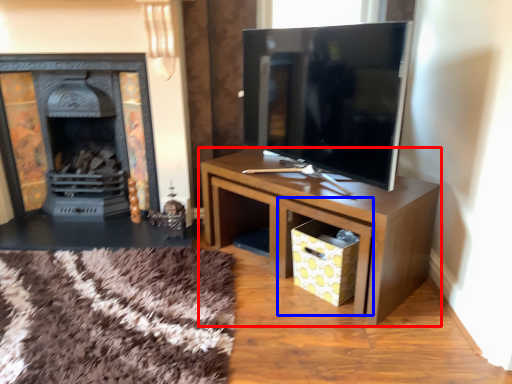
Question: Which of the following is the closest to the observer, table (highlighted by a red box) or drawer (highlighted by a blue box)?

Choices:
 (A) table
 (B) drawer

Answer: (A)